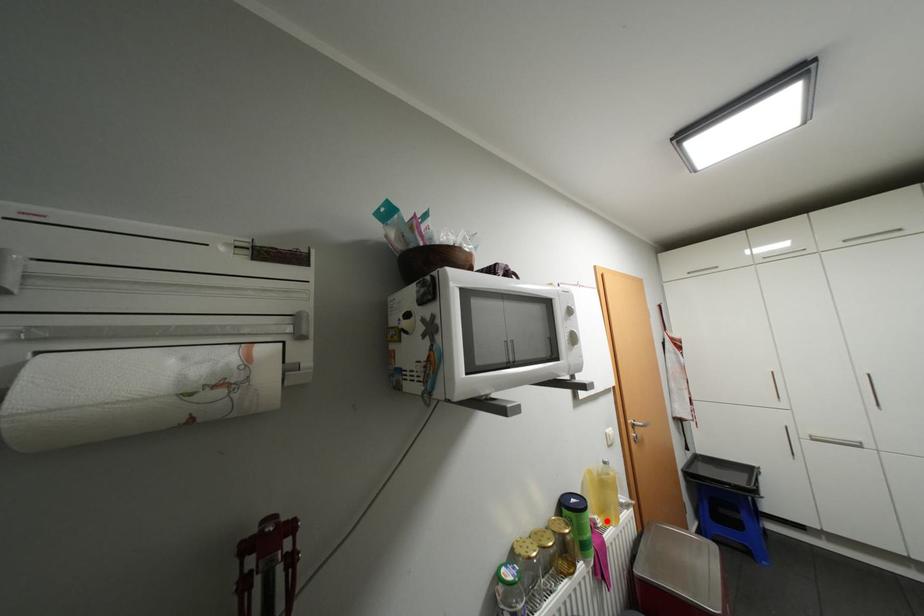
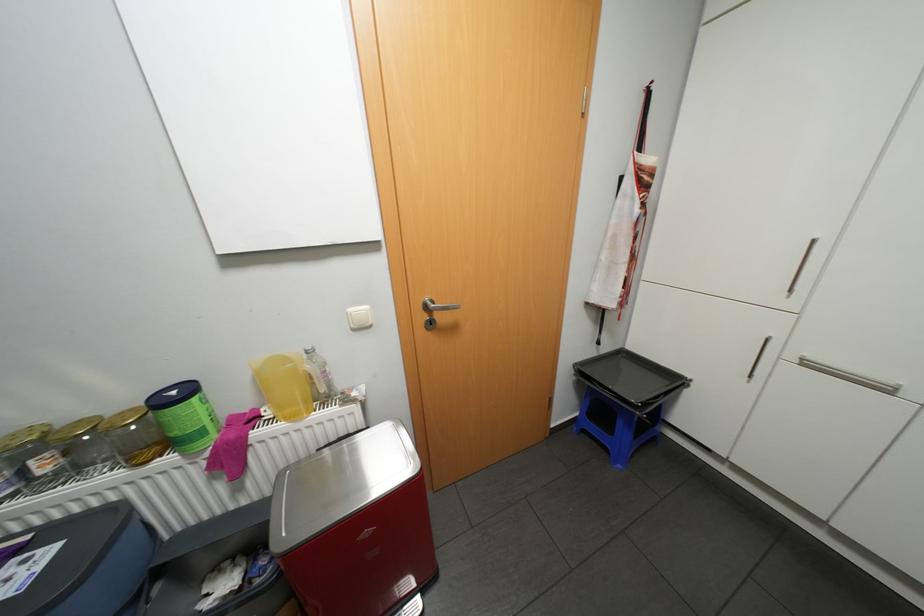
Find the pixel in the second image that matches the highlighted location in the first image.

(275, 413)